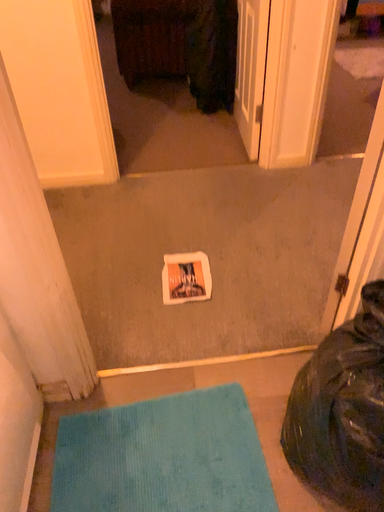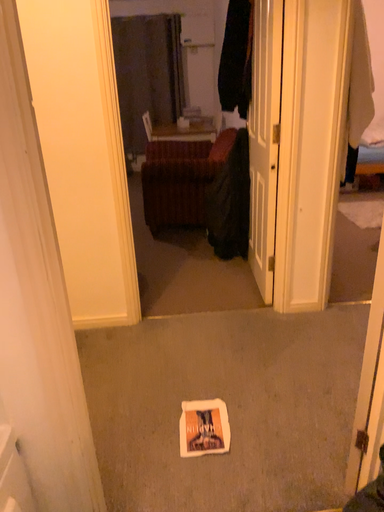
Question: How did the camera likely rotate when shooting the video?

Choices:
 (A) rotated upward
 (B) rotated downward

Answer: (A)